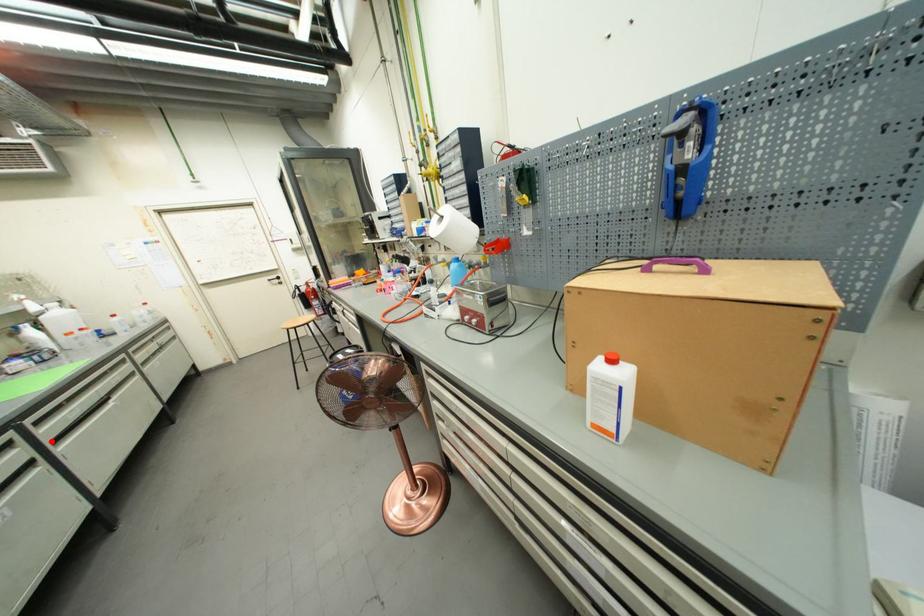
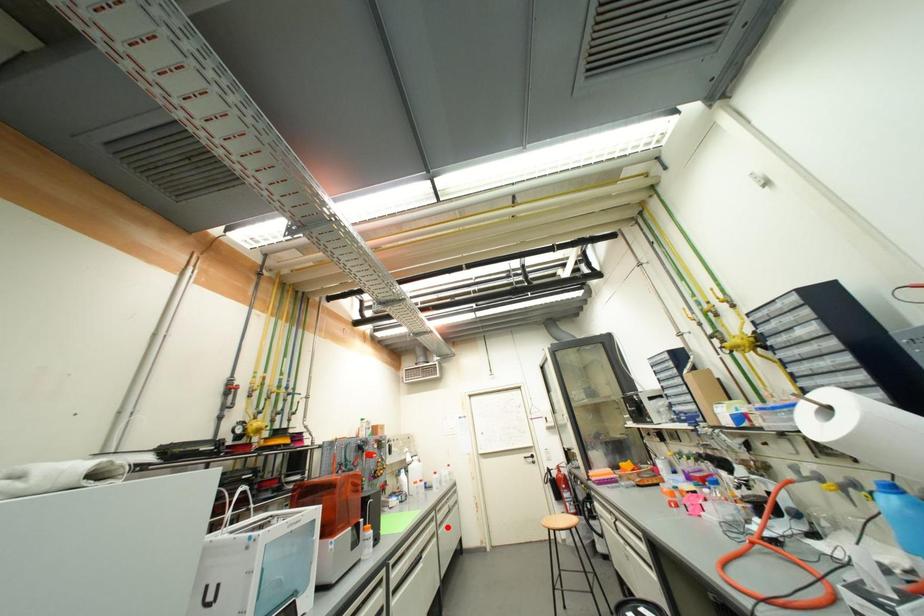
I am providing you with two images of the same scene from different viewpoints. A red point is marked on the first image and another point is marked on the second image. Does the point marked in image1 correspond to the same location as the one in image2?

No